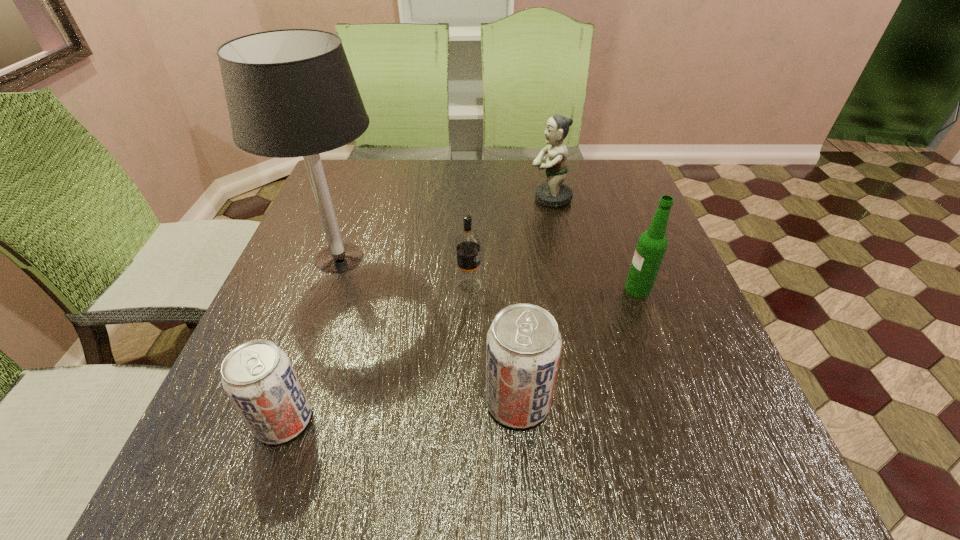
Image resolution: width=960 pixels, height=540 pixels. What are the coordinates of `the left soda can` in the screenshot? It's located at (257, 376).

At what (x,y) coordinates should I click in order to perform the action: click on the fourth object from left to right. Please return your answer as a coordinate pair (x, y). Looking at the image, I should click on (523, 347).

Find the location of a particular element. the taller soda can is located at coordinates (523, 347).

Find the location of a particular element. the farthest object is located at coordinates (554, 193).

Identify the location of figurine. [554, 193].

Where is `the fourth object from right to left`? Image resolution: width=960 pixels, height=540 pixels. the fourth object from right to left is located at coordinates (468, 281).

Find the location of a particular element. The image size is (960, 540). the tallest object is located at coordinates (290, 93).

Locate an element on the screen. The image size is (960, 540). beer bottle is located at coordinates [652, 244].

This screenshot has height=540, width=960. In order to click on vacant space situated 0.070m on the right of the shorter soda can in this screenshot , I will do `click(354, 421)`.

I want to click on blank space located 0.250m on the back of the right soda can, so click(x=509, y=280).